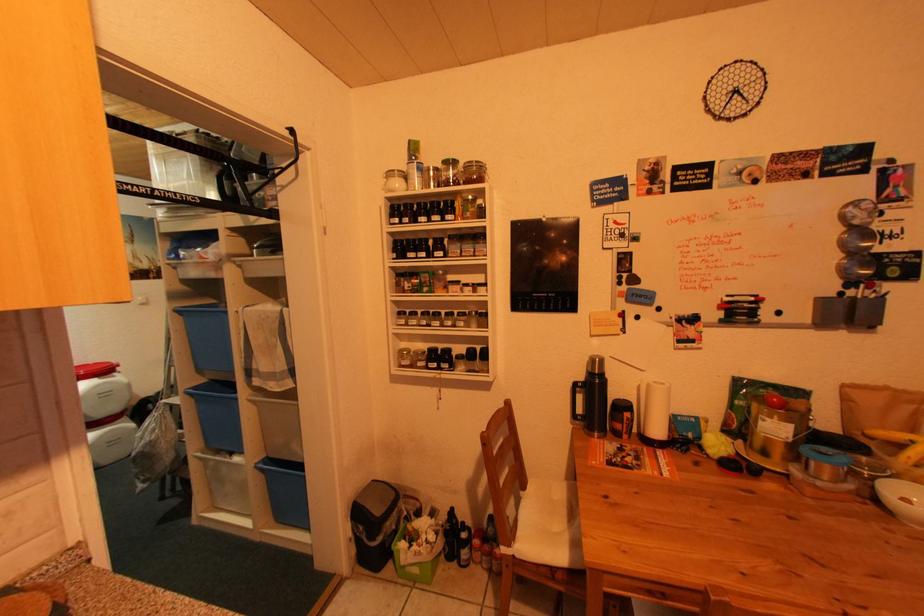
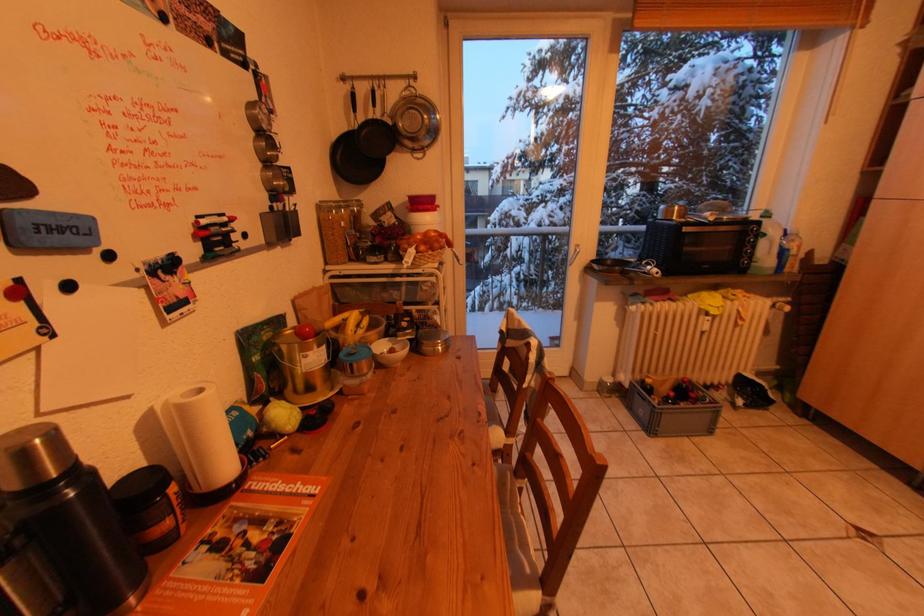
How did the camera likely rotate?

The rotation direction of the camera is right-down.